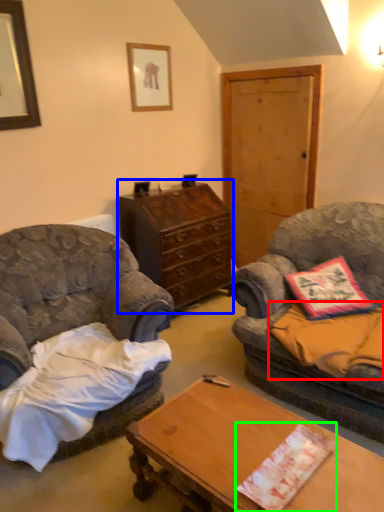
Question: Which is nearer to the sheet (highlighted by a red box)? cabinetry (highlighted by a blue box) or sheet (highlighted by a green box).

Choices:
 (A) cabinetry
 (B) sheet

Answer: (B)